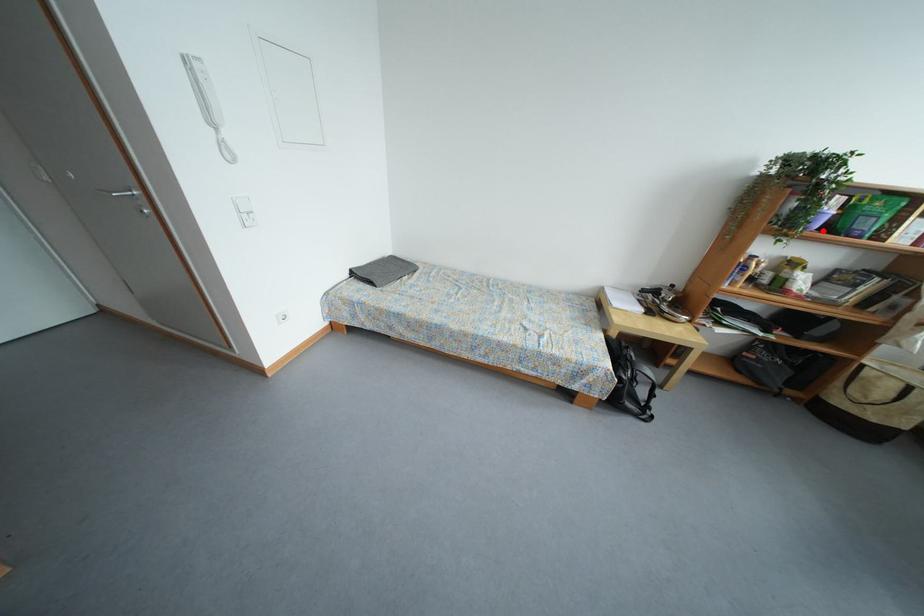
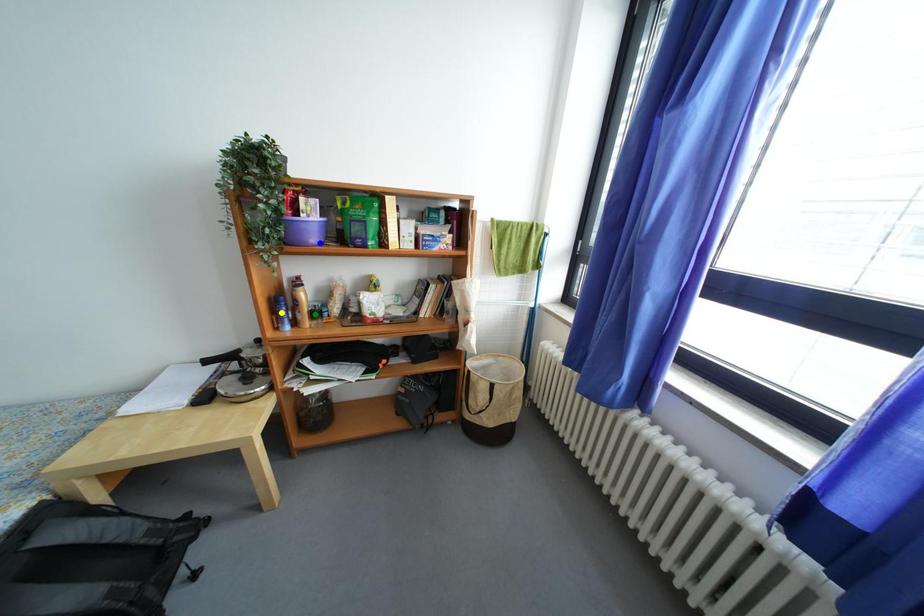
Question: I am providing you with two images of the same scene from different viewpoints. A red point is marked on the first image. You are given multiple points on the second image. In image 2, which mark is for the same physical point as the one in image 1?

Choices:
 (A) green point
 (B) blue point
 (C) yellow point

Answer: (B)